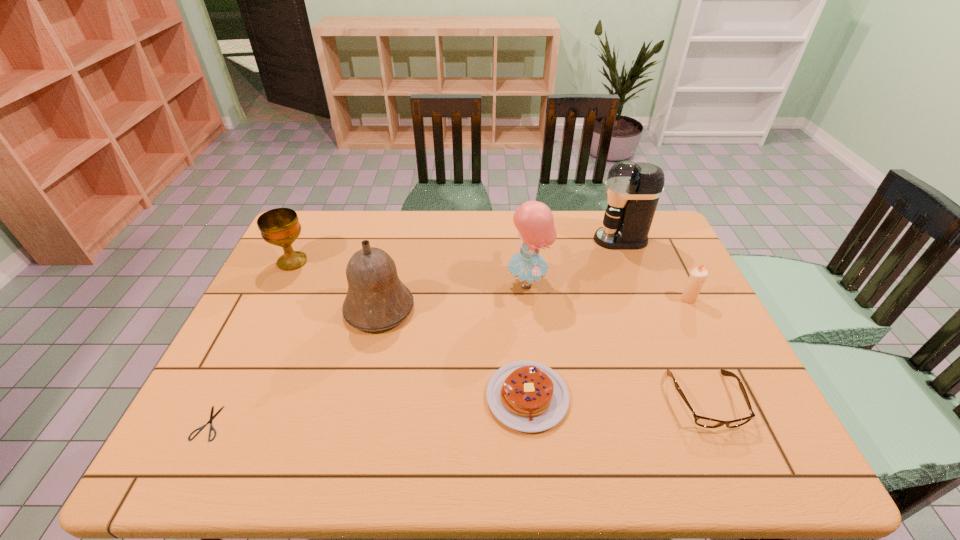
Find the location of a particular element. The height and width of the screenshot is (540, 960). free spot between the candle and the farthest object is located at coordinates (655, 269).

Find the location of a particular element. Image resolution: width=960 pixels, height=540 pixels. free spot between the candle and the coffee maker is located at coordinates (655, 269).

Where is `free spot between the farthest object and the spectacles`? free spot between the farthest object and the spectacles is located at coordinates (663, 320).

I want to click on free space that is in between the third object from left to right and the coffee maker, so click(500, 274).

Find the location of a particular element. vacant space that's between the doll and the coffee maker is located at coordinates (574, 261).

The image size is (960, 540). Identify the location of free spot between the coffee maker and the pancake. (574, 318).

I want to click on vacant area that lies between the doll and the pancake, so click(x=528, y=340).

Where is `free space between the doll and the chalice`? This screenshot has height=540, width=960. free space between the doll and the chalice is located at coordinates (410, 272).

At what (x,y) coordinates should I click in order to perform the action: click on free space between the shears and the candle. Please return your answer as a coordinate pair (x, y). Image resolution: width=960 pixels, height=540 pixels. Looking at the image, I should click on (448, 361).

Point out which object is positioned as the third nearest to the doll. Please provide its 2D coordinates. Your answer should be formatted as a tuple, i.e. [(x, y)], where the tuple contains the x and y coordinates of a point satisfying the conditions above.

[(376, 300)]